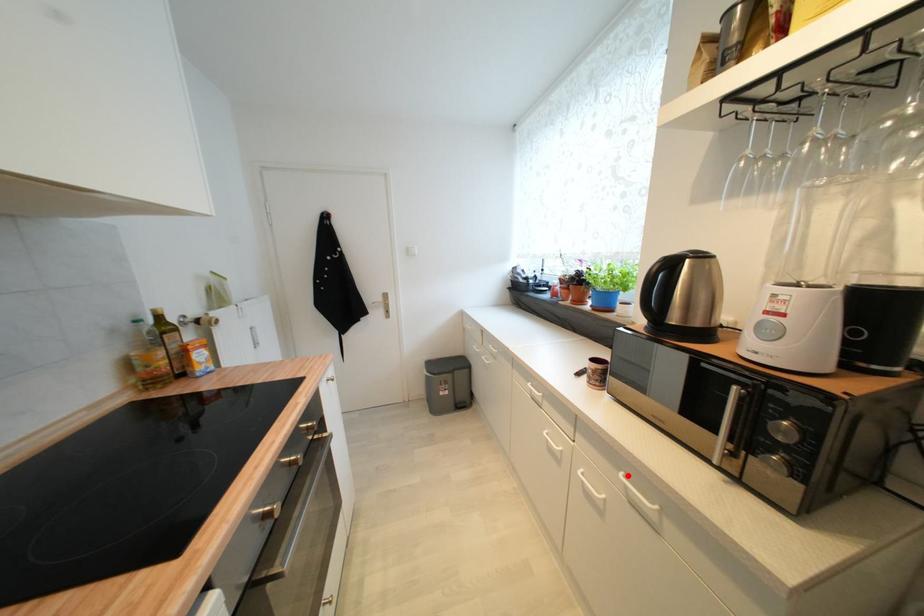
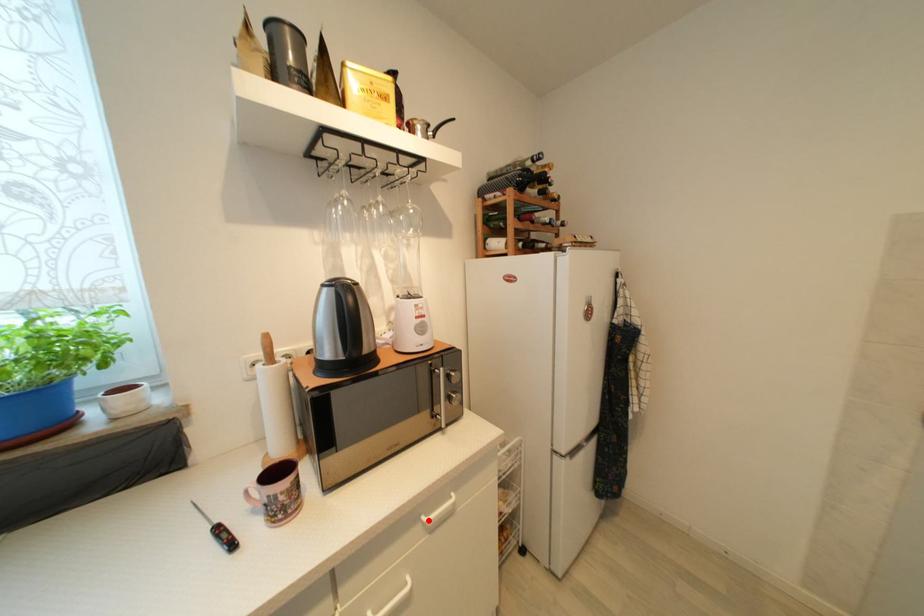
I am providing you with two images of the same scene from different viewpoints. A red point is marked on the first image and another point is marked on the second image. Does the point marked in image1 correspond to the same location as the one in image2?

Yes